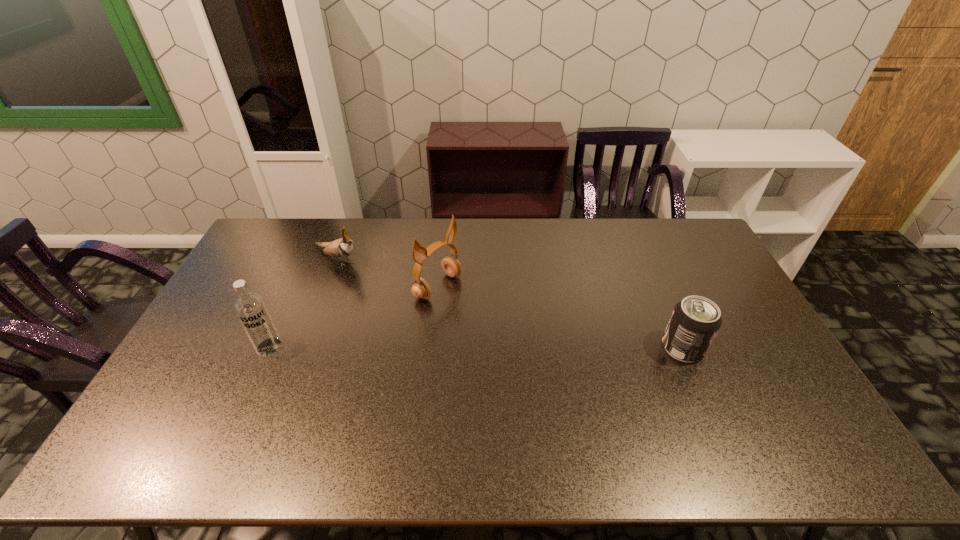
You are a GUI agent. You are given a task and a screenshot of the screen. Output one action in this format:
    pyautogui.click(x=<x>, y=<y>)
    Task: Click on the vodka
    
    Given the screenshot: What is the action you would take?
    pyautogui.click(x=251, y=310)

Where is `the rightmost object`? This screenshot has height=540, width=960. the rightmost object is located at coordinates (695, 321).

I want to click on bird, so click(341, 248).

At what (x,y) coordinates should I click in order to perform the action: click on earphone. Please return your answer as a coordinate pair (x, y). This screenshot has width=960, height=540. Looking at the image, I should click on (451, 266).

Locate an element on the screen. Image resolution: width=960 pixels, height=540 pixels. free region located on the front label of the vodka is located at coordinates (258, 372).

Identify the location of free space located 0.230m on the left of the rightmost object. The width and height of the screenshot is (960, 540). (584, 348).

At what (x,y) coordinates should I click in order to perform the action: click on vacant area located at the face of the bird. Please return your answer as a coordinate pair (x, y). This screenshot has height=540, width=960. Looking at the image, I should click on (405, 296).

What are the coordinates of `free space located 0.240m at the face of the bird` in the screenshot? It's located at (405, 296).

This screenshot has width=960, height=540. I want to click on free region located 0.260m at the face of the bird, so click(409, 299).

At what (x,y) coordinates should I click in order to perform the action: click on vacant area situated on the front-facing side of the second object from right to left. Please return your answer as a coordinate pair (x, y). Looking at the image, I should click on (526, 343).